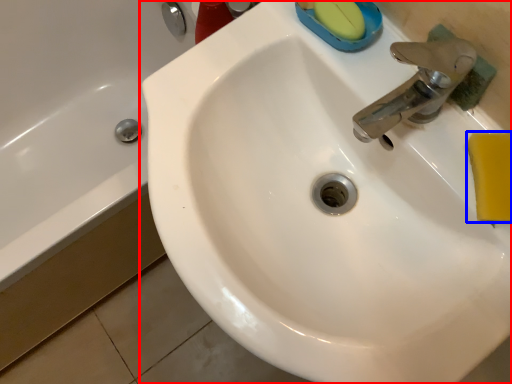
Question: Among these objects, which one is nearest to the camera, sink (highlighted by a red box) or soap (highlighted by a blue box)?

Choices:
 (A) sink
 (B) soap

Answer: (B)